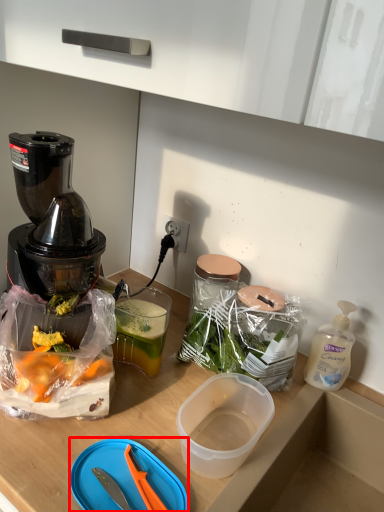
Question: From the image's perspective, where is cutting board (annotated by the red box) located in relation to bottle in the image?

Choices:
 (A) below
 (B) above

Answer: (A)